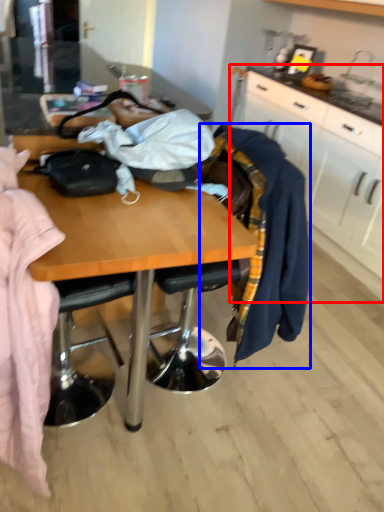
Question: Which point is further to the camera, cabinetry (highlighted by a red box) or clothing (highlighted by a blue box)?

Choices:
 (A) cabinetry
 (B) clothing

Answer: (A)